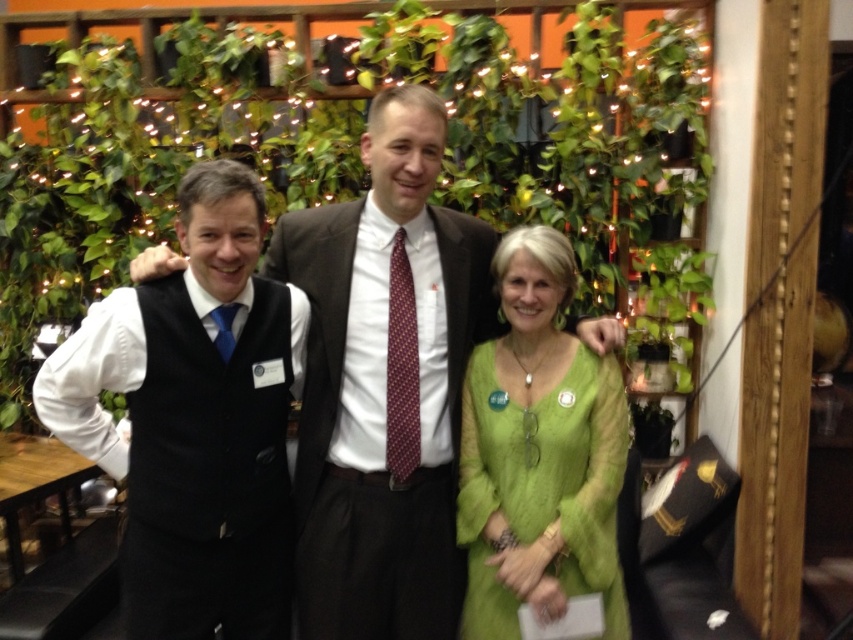
Which is more to the left, black wool vest at left or green sheer dress at center?

From the viewer's perspective, black wool vest at left appears more on the left side.

Can you confirm if black wool vest at left is taller than green sheer dress at center?

Yes, black wool vest at left is taller than green sheer dress at center.

The width and height of the screenshot is (853, 640). What are the coordinates of `black wool vest at left` in the screenshot? It's located at (194, 419).

Who is taller, dark brown wool suit at center or green sheer dress at center?

dark brown wool suit at center is taller.

What do you see at coordinates (381, 408) in the screenshot? The height and width of the screenshot is (640, 853). I see `dark brown wool suit at center` at bounding box center [381, 408].

Find the location of a particular element. The image size is (853, 640). dark brown wool suit at center is located at coordinates (381, 408).

Does matte black vest at left come behind green sheer dress at center?

That is False.

Between matte black vest at left and green sheer dress at center, which one has less height?

With less height is green sheer dress at center.

Who is more distant from viewer, (x=363, y=390) or (x=548, y=276)?

The point (x=363, y=390) is behind.

This screenshot has width=853, height=640. Identify the location of matte black vest at left. (384, 384).